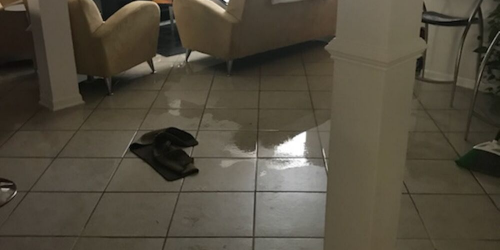
I want to click on towel, so click(172, 157).